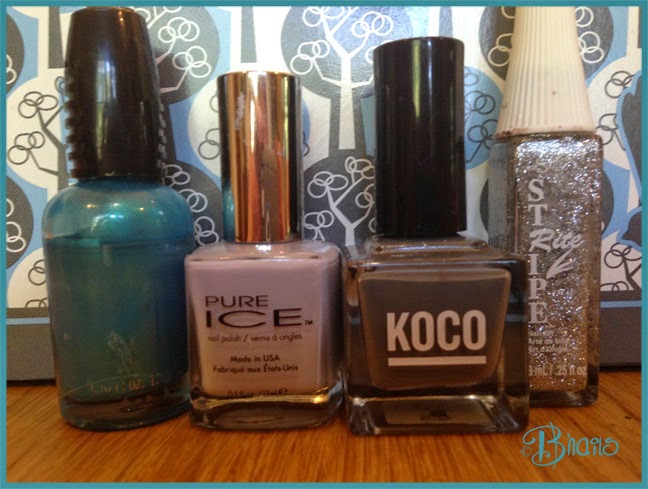
Identify the location of white lamp shade looking cap. (555, 67).